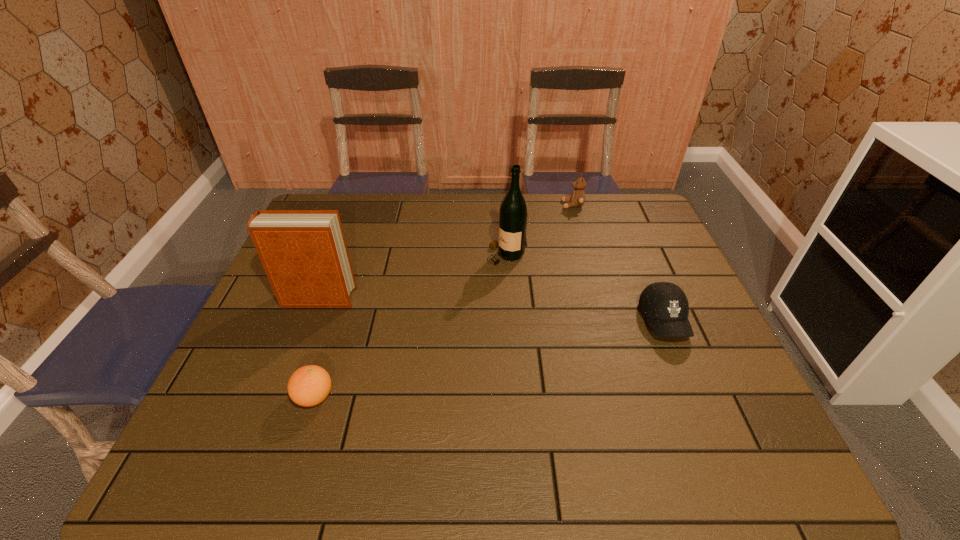
Locate an element on the screen. The height and width of the screenshot is (540, 960). free space between the rightmost object and the third shortest object is located at coordinates (618, 263).

You are a GUI agent. You are given a task and a screenshot of the screen. Output one action in this format:
    pyautogui.click(x=<x>, y=<y>)
    Task: Click on the vacant area between the rightmost object and the fourth nearest object
    
    Given the screenshot: What is the action you would take?
    pyautogui.click(x=585, y=288)

Find the location of a particular element. The image size is (960, 540). free space between the hardback book and the second farthest object is located at coordinates (412, 276).

Identify the location of vacant space that is in between the orange and the baseball cap. Image resolution: width=960 pixels, height=540 pixels. (490, 359).

I want to click on vacant space that is in between the orange and the hardback book, so click(316, 348).

Where is `free space that is in between the orange and the hardback book`? The height and width of the screenshot is (540, 960). free space that is in between the orange and the hardback book is located at coordinates (316, 348).

The image size is (960, 540). I want to click on the third closest object relative to the farthest object, so click(x=304, y=253).

This screenshot has height=540, width=960. In order to click on object that ranks as the third closest to the orange in this screenshot , I will do (665, 305).

Image resolution: width=960 pixels, height=540 pixels. In order to click on vacant position in the image that satisfies the following two spatial constraints: 1. on the front-facing side of the teddy bear; 2. on the front side of the orange in this screenshot , I will do `click(627, 397)`.

At what (x,y) coordinates should I click in order to perform the action: click on vacant space that satisfies the following two spatial constraints: 1. on the open cover of the hardback book; 2. on the left side of the nearest object. Please return your answer as a coordinate pair (x, y). Looking at the image, I should click on (280, 397).